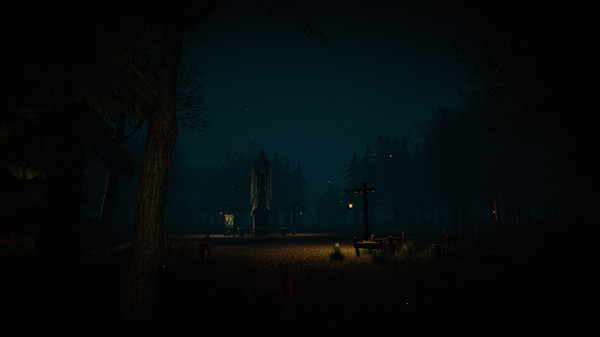
Identify the location of table. (398, 137), (370, 242).